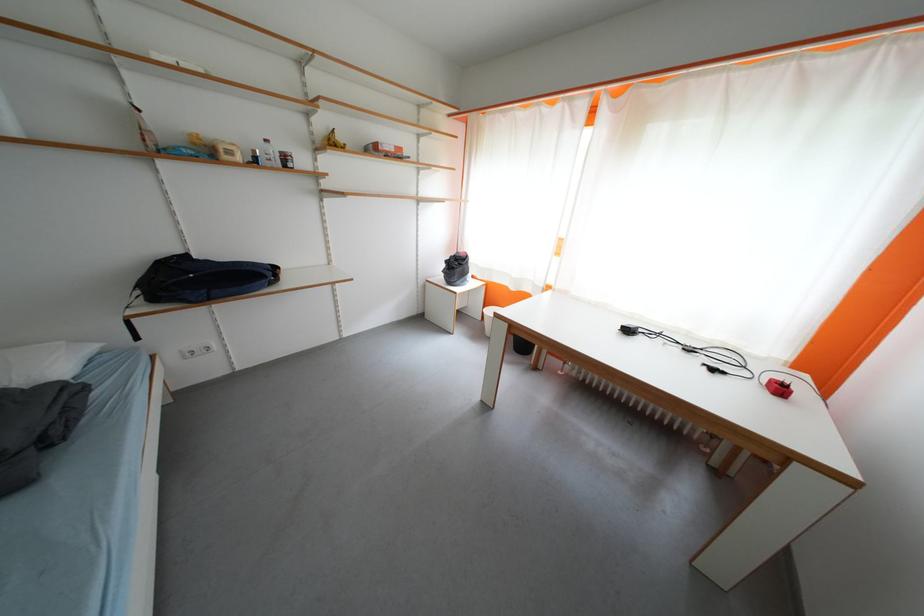
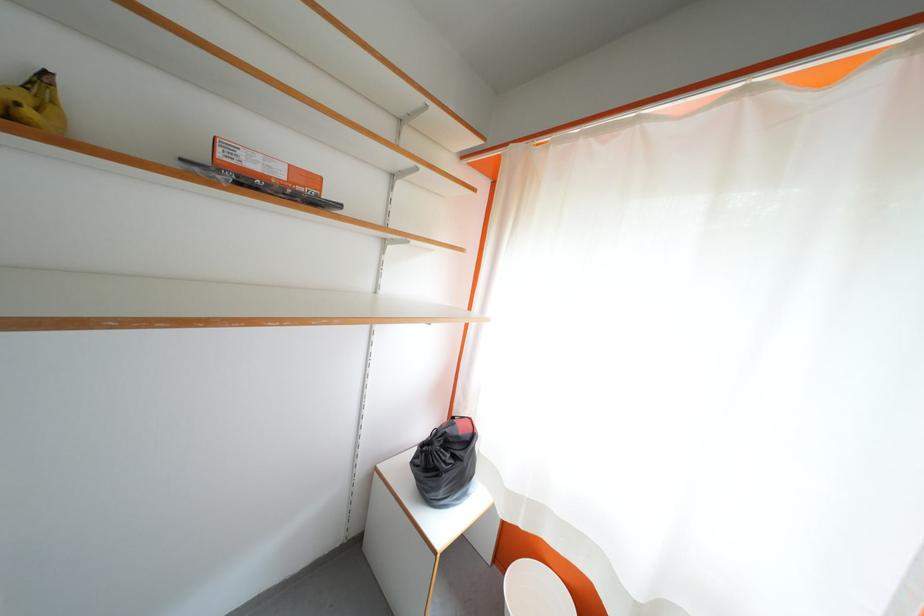
In the second image, find the point that corresponds to pixel 465 270 in the first image.

(455, 460)